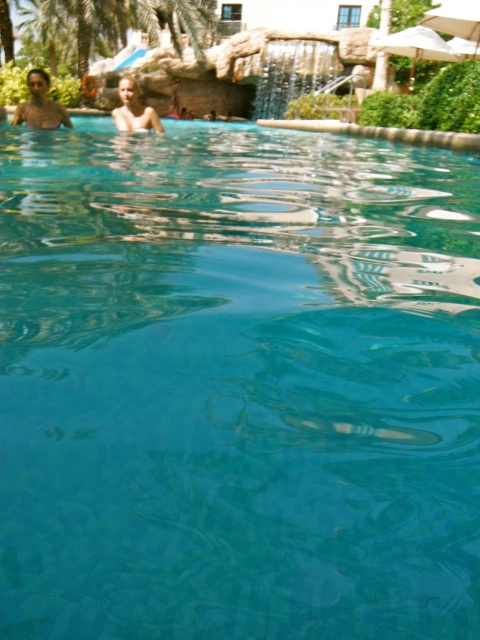
You are a lifeguard observing the pool area. There is a point labeled as point (39, 104) in the image. What material does this point correspond to?

The point (39, 104) corresponds to matte skin at upper left.

You are a photographer capturing the scene from above the pool. You notice two people at the upper left corner. Which of the two, the matte skin at upper left or the blonde hair human at upper left, has a smaller width when viewed from this angle?

The matte skin at upper left is thinner than the blonde hair human at upper left, so the matte skin at upper left has a smaller width when viewed from above the pool.

Based on the photo, you are standing at the center of the pool and want to locate the matte skin at upper left. According to the coordinates provided, in which direction should you look to find it?

The matte skin at upper left is located at coordinates point (x=39, y=104), so you should look to the upper left direction to find it.